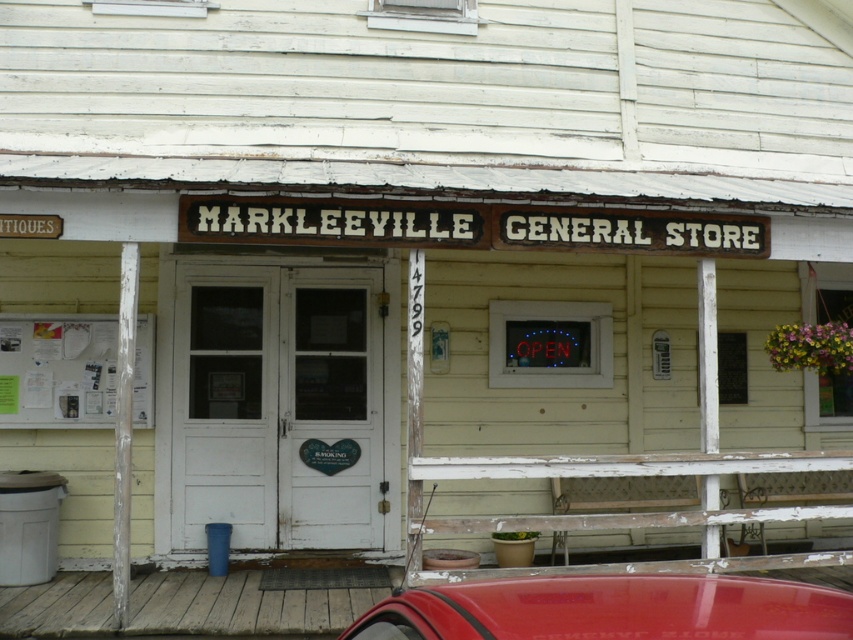
You are a customer arriving at the Markleeville General Store and see the shiny red car at lower center and the white paperboard at left. Where is the shiny red car located relative to the white paperboard?

The shiny red car at lower center is positioned under the white paperboard at left.

You are standing in front of the Markleeville General Store and see a shiny red car at lower center and a white paperboard at left. Which object is positioned to the right of the other?

The shiny red car at lower center is positioned to the right of the white paperboard at left.